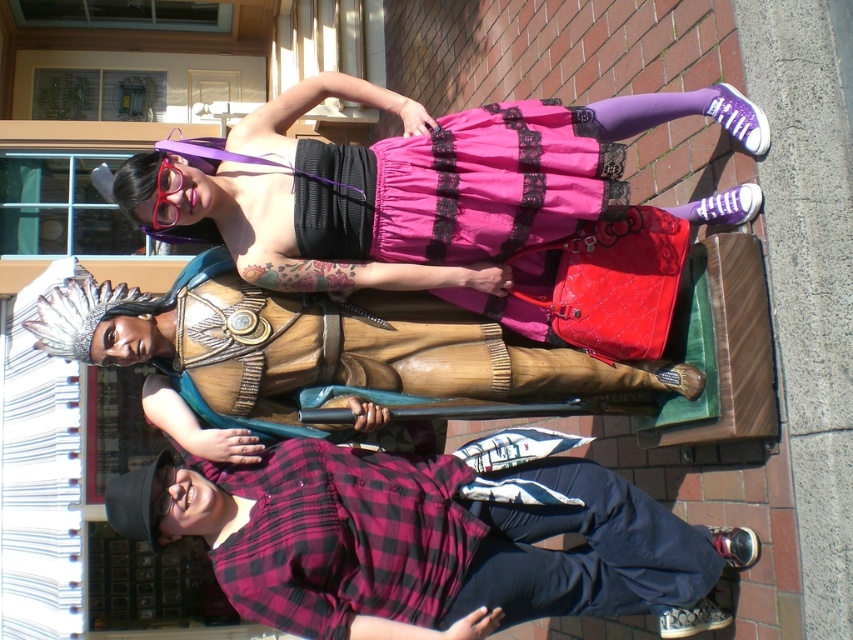
You are a photographer trying to capture a photo of the pink satin skirt at upper center and the wooden statue at center. Based on their positions, which object is located to the right of the other?

The pink satin skirt at upper center is positioned on the right side of wooden statue at center.

You are a photographer setting up a shot. You have two items in your scene, the plaid flannel shirt at lower left and the wooden statue at center. Which object is narrower?

The plaid flannel shirt at lower left is narrower than the wooden statue at center.

You are a photographer setting up for a group photo. You need to ensure there is enough space between the pink satin skirt at upper center and the wooden statue at center for a 30 inch wide camera tripod. Is there sufficient space between them?

The distance between the pink satin skirt at upper center and the wooden statue at center is 27.60 inches, which is less than the required 30 inches for the tripod. Therefore, there is not enough space.